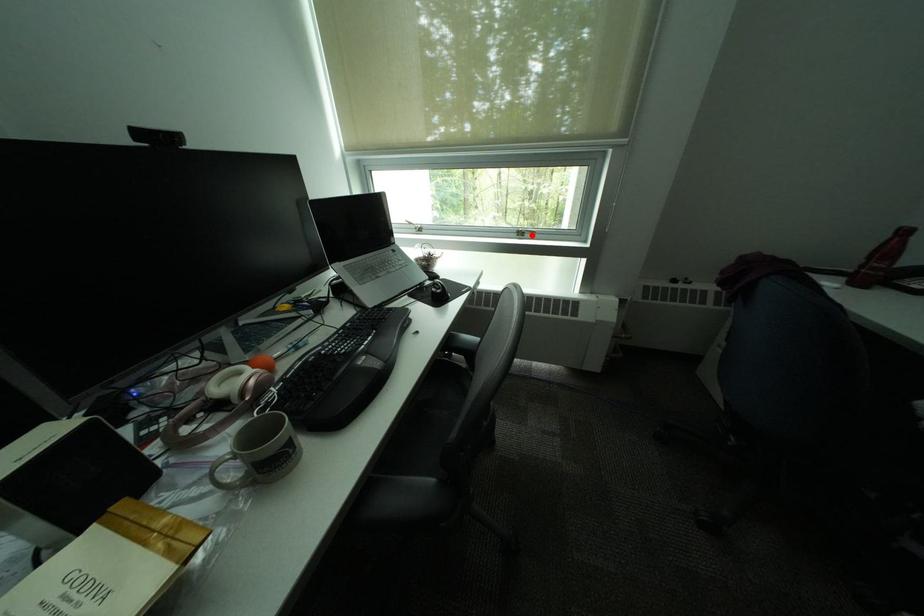
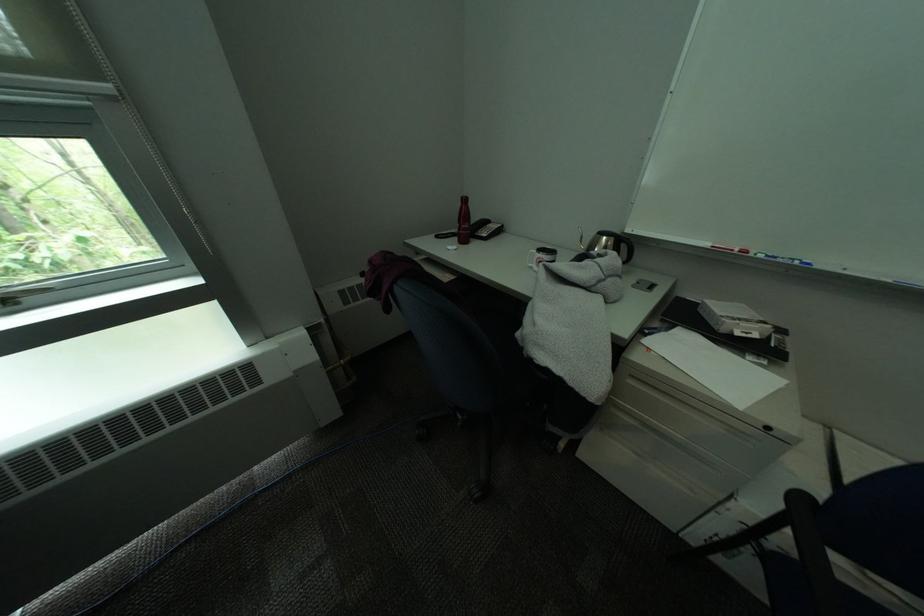
Find the pixel in the second image that matches the highlighted location in the first image.

(15, 302)